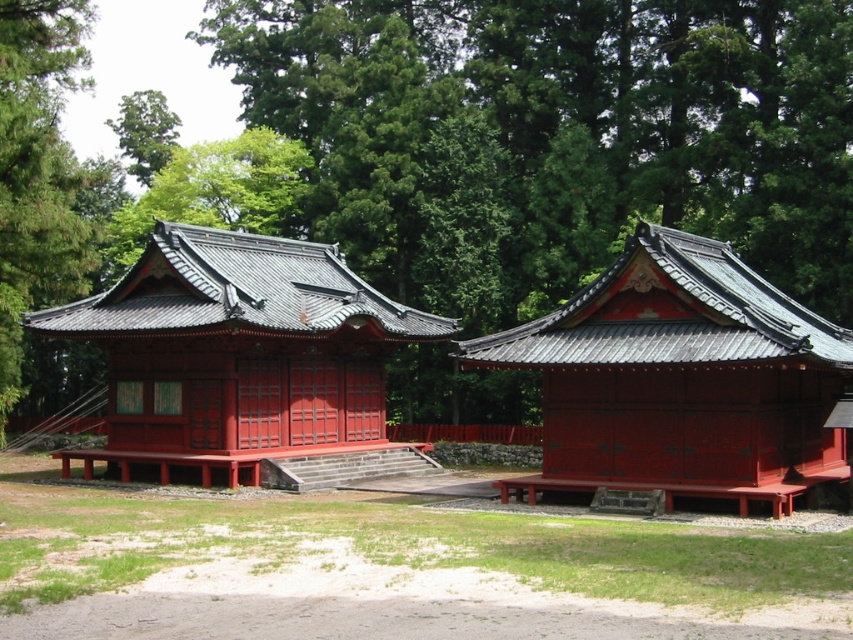
Is shiny red wood gazebo at center thinner than shiny lacquered shrine at center?

Indeed, shiny red wood gazebo at center has a lesser width compared to shiny lacquered shrine at center.

Is shiny red wood gazebo at center smaller than shiny lacquered shrine at center?

Indeed, shiny red wood gazebo at center has a smaller size compared to shiny lacquered shrine at center.

Between point (596, 429) and point (305, 426), which one is positioned in front?

Positioned in front is point (596, 429).

At what (x,y) coordinates should I click in order to perform the action: click on shiny red wood gazebo at center. Please return your answer as a coordinate pair (x, y). Image resolution: width=853 pixels, height=640 pixels. Looking at the image, I should click on (682, 378).

Does green leafy tree at upper center appear under shiny lacquered shrine at center?

Incorrect, green leafy tree at upper center is not positioned below shiny lacquered shrine at center.

Does point (247, 20) lie in front of point (148, 392)?

No, it is not.

Find the location of a particular element. The image size is (853, 640). green leafy tree at upper center is located at coordinates (442, 150).

The height and width of the screenshot is (640, 853). In order to click on green leafy tree at upper center in this screenshot , I will do `click(442, 150)`.

Can you confirm if green leafy tree at upper center is smaller than shiny red wood gazebo at center?

Incorrect, green leafy tree at upper center is not smaller in size than shiny red wood gazebo at center.

Is point (666, 120) positioned after point (643, 340)?

Yes, point (666, 120) is behind point (643, 340).

Locate an element on the screen. The width and height of the screenshot is (853, 640). green leafy tree at upper center is located at coordinates (442, 150).